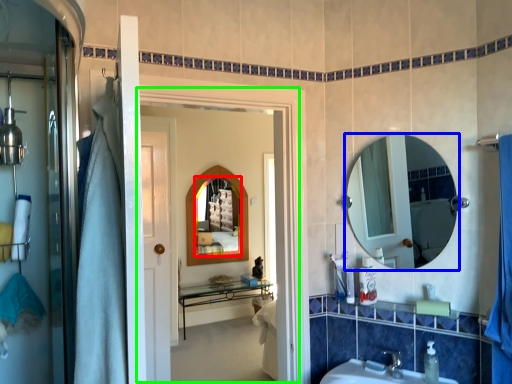
Question: Which is nearer to the mirror (highlighted by a red box)? mirror (highlighted by a blue box) or screen door (highlighted by a green box).

Choices:
 (A) mirror
 (B) screen door

Answer: (A)